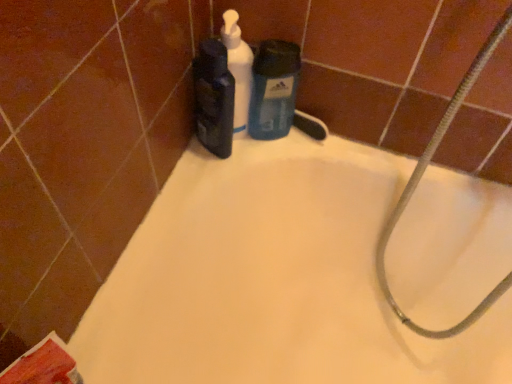
This screenshot has width=512, height=384. I want to click on white matte bathtub at upper center, so 272,279.

What is the approximate width of white matte pump bottle at upper center, acting as the 2th cleaning product starting from the right?

white matte pump bottle at upper center, acting as the 2th cleaning product starting from the right, is 1.84 inches in width.

Find the location of a particular element. The height and width of the screenshot is (384, 512). silvery metallic hose at upper right is located at coordinates (419, 181).

In order to face matte black bottle at upper center, the third cleaning product in the right-to-left sequence, should I rotate leftwards or rightwards?

Turn left by 4.477 degrees to look at matte black bottle at upper center, the third cleaning product in the right-to-left sequence.

Where is `white matte bathtub at upper center`? Image resolution: width=512 pixels, height=384 pixels. white matte bathtub at upper center is located at coordinates (272, 279).

From a real-world perspective, is white matte pump bottle at upper center, which is counted as the second cleaning product, starting from the left, located higher than matte black bottle at upper center, acting as the first cleaning product starting from the left?

Yes.

Looking at this image, considering the relative positions of white matte pump bottle at upper center, which is counted as the second cleaning product, starting from the left, and matte black bottle at upper center, the third cleaning product in the right-to-left sequence, in the image provided, is white matte pump bottle at upper center, which is counted as the second cleaning product, starting from the left, to the left of matte black bottle at upper center, the third cleaning product in the right-to-left sequence, from the viewer's perspective?

No, white matte pump bottle at upper center, which is counted as the second cleaning product, starting from the left, is not to the left of matte black bottle at upper center, the third cleaning product in the right-to-left sequence.

Between white matte pump bottle at upper center, acting as the 2th cleaning product starting from the right, and matte black bottle at upper center, acting as the first cleaning product starting from the left, which one has more height?

white matte pump bottle at upper center, acting as the 2th cleaning product starting from the right.

Is white matte pump bottle at upper center, acting as the 2th cleaning product starting from the right, facing towards matte black bottle at upper center, acting as the first cleaning product starting from the left?

Yes, white matte pump bottle at upper center, acting as the 2th cleaning product starting from the right, is facing matte black bottle at upper center, acting as the first cleaning product starting from the left.

In the image, is silvery metallic hose at upper right positioned in front of or behind white matte bathtub at upper center?

Clearly, silvery metallic hose at upper right is in front of white matte bathtub at upper center.

Measure the distance from silvery metallic hose at upper right to white matte bathtub at upper center.

silvery metallic hose at upper right is 6.88 inches away from white matte bathtub at upper center.

What are the coordinates of `bathtub below the silvery metallic hose at upper right (from the image's perspective)` in the screenshot? It's located at (272, 279).

Is matte black bottle at upper center, acting as the first cleaning product starting from the left, positioned with its back to white matte pump bottle at upper center, acting as the 2th cleaning product starting from the right?

Yes, matte black bottle at upper center, acting as the first cleaning product starting from the left,'s orientation is away from white matte pump bottle at upper center, acting as the 2th cleaning product starting from the right.

From a real-world perspective, is matte black bottle at upper center, acting as the first cleaning product starting from the left, located higher than white matte pump bottle at upper center, acting as the 2th cleaning product starting from the right?

No.

From the picture: Does matte black bottle at upper center, the third cleaning product in the right-to-left sequence, have a larger size compared to white matte pump bottle at upper center, acting as the 2th cleaning product starting from the right?

Yes.

Does matte black bottle at upper center, acting as the first cleaning product starting from the left, have a lesser width compared to white matte pump bottle at upper center, which is counted as the second cleaning product, starting from the left?

No, matte black bottle at upper center, acting as the first cleaning product starting from the left, is not thinner than white matte pump bottle at upper center, which is counted as the second cleaning product, starting from the left.

Visually, is blue matte liquid soap at center, which is the 3th cleaning product in left-to-right order, positioned to the left or to the right of matte black bottle at upper center, acting as the first cleaning product starting from the left?

From the image, it's evident that blue matte liquid soap at center, which is the 3th cleaning product in left-to-right order, is to the right of matte black bottle at upper center, acting as the first cleaning product starting from the left.

From a real-world perspective, is blue matte liquid soap at center, which is the 3th cleaning product in left-to-right order, on matte black bottle at upper center, the third cleaning product in the right-to-left sequence?

No, from a real-world perspective, blue matte liquid soap at center, which is the 3th cleaning product in left-to-right order, is not above matte black bottle at upper center, the third cleaning product in the right-to-left sequence.

Starting from the blue matte liquid soap at center, which ranks as the 1th cleaning product in right-to-left order, which cleaning product is the 2nd one in front? Please provide its 2D coordinates.

[(214, 98)]

Is silvery metallic hose at upper right in front of or behind white matte pump bottle at upper center, acting as the 2th cleaning product starting from the right, in the image?

silvery metallic hose at upper right is positioned closer to the viewer than white matte pump bottle at upper center, acting as the 2th cleaning product starting from the right.

Looking at this image, is silvery metallic hose at upper right not close to white matte pump bottle at upper center, acting as the 2th cleaning product starting from the right?

No, silvery metallic hose at upper right is in close proximity to white matte pump bottle at upper center, acting as the 2th cleaning product starting from the right.

Is silvery metallic hose at upper right inside the boundaries of white matte pump bottle at upper center, which is counted as the second cleaning product, starting from the left, or outside?

The correct answer is: outside.

From the image's perspective, is silvery metallic hose at upper right above or below white matte pump bottle at upper center, which is counted as the second cleaning product, starting from the left?

silvery metallic hose at upper right is situated lower than white matte pump bottle at upper center, which is counted as the second cleaning product, starting from the left, in the image.

Is white matte pump bottle at upper center, acting as the 2th cleaning product starting from the right, looking in the opposite direction of silvery metallic hose at upper right?

No, silvery metallic hose at upper right is not at the back of white matte pump bottle at upper center, acting as the 2th cleaning product starting from the right.

Is point (248, 106) positioned behind point (405, 195)?

That is False.

Considering the relative sizes of white matte pump bottle at upper center, acting as the 2th cleaning product starting from the right, and silvery metallic hose at upper right in the image provided, is white matte pump bottle at upper center, acting as the 2th cleaning product starting from the right, bigger than silvery metallic hose at upper right?

No.

Is white matte pump bottle at upper center, which is counted as the second cleaning product, starting from the left, positioned in front of silvery metallic hose at upper right?

No, white matte pump bottle at upper center, which is counted as the second cleaning product, starting from the left, is behind silvery metallic hose at upper right.

Consider the image. Can you tell me how much matte black bottle at upper center, acting as the first cleaning product starting from the left, and blue matte liquid soap at center, which is the 3th cleaning product in left-to-right order, differ in facing direction?

The angular difference between matte black bottle at upper center, acting as the first cleaning product starting from the left, and blue matte liquid soap at center, which is the 3th cleaning product in left-to-right order, is 34.8 degrees.

Is point (200, 43) farther from camera compared to point (295, 91)?

No, it is in front of (295, 91).

Is matte black bottle at upper center, acting as the first cleaning product starting from the left, aimed at blue matte liquid soap at center, which ranks as the 1th cleaning product in right-to-left order?

No, matte black bottle at upper center, acting as the first cleaning product starting from the left, is not oriented towards blue matte liquid soap at center, which ranks as the 1th cleaning product in right-to-left order.

How distant is matte black bottle at upper center, the third cleaning product in the right-to-left sequence, from blue matte liquid soap at center, which is the 3th cleaning product in left-to-right order?

matte black bottle at upper center, the third cleaning product in the right-to-left sequence, is 2.94 inches away from blue matte liquid soap at center, which is the 3th cleaning product in left-to-right order.

Find the location of a particular element. This screenshot has height=384, width=512. cleaning product that appears in front of the white matte pump bottle at upper center, acting as the 2th cleaning product starting from the right is located at coordinates (214, 98).

Locate an element on the screen. The height and width of the screenshot is (384, 512). garden hose above the white matte bathtub at upper center (from a real-world perspective) is located at coordinates [419, 181].

Which object lies nearer to the anchor point silvery metallic hose at upper right, white matte bathtub at upper center or matte black bottle at upper center, acting as the first cleaning product starting from the left?

white matte bathtub at upper center is positioned closer to the anchor silvery metallic hose at upper right.

When comparing their distances from silvery metallic hose at upper right, does blue matte liquid soap at center, which is the 3th cleaning product in left-to-right order, or white matte bathtub at upper center seem closer?

white matte bathtub at upper center.

From the image, which object appears to be nearer to matte black bottle at upper center, acting as the first cleaning product starting from the left, white matte bathtub at upper center or blue matte liquid soap at center, which is the 3th cleaning product in left-to-right order?

blue matte liquid soap at center, which is the 3th cleaning product in left-to-right order, is closer to matte black bottle at upper center, acting as the first cleaning product starting from the left.

In the scene shown: Estimate the real-world distances between objects in this image. Which object is closer to silvery metallic hose at upper right, white matte pump bottle at upper center, acting as the 2th cleaning product starting from the right, or matte black bottle at upper center, acting as the first cleaning product starting from the left?

white matte pump bottle at upper center, acting as the 2th cleaning product starting from the right, is closer to silvery metallic hose at upper right.

Looking at the image, which one is located closer to silvery metallic hose at upper right, white matte bathtub at upper center or blue matte liquid soap at center, which ranks as the 1th cleaning product in right-to-left order?

Based on the image, white matte bathtub at upper center appears to be nearer to silvery metallic hose at upper right.

When comparing their distances from blue matte liquid soap at center, which is the 3th cleaning product in left-to-right order, does matte black bottle at upper center, the third cleaning product in the right-to-left sequence, or white matte bathtub at upper center seem further?

white matte bathtub at upper center is positioned further to the anchor blue matte liquid soap at center, which is the 3th cleaning product in left-to-right order.

From the image, which object appears to be nearer to white matte bathtub at upper center, silvery metallic hose at upper right or white matte pump bottle at upper center, which is counted as the second cleaning product, starting from the left?

silvery metallic hose at upper right lies closer to white matte bathtub at upper center than the other object.

When comparing their distances from silvery metallic hose at upper right, does white matte bathtub at upper center or white matte pump bottle at upper center, acting as the 2th cleaning product starting from the right, seem closer?

Among the two, white matte bathtub at upper center is located nearer to silvery metallic hose at upper right.

The image size is (512, 384). In order to click on garden hose between blue matte liquid soap at center, which ranks as the 1th cleaning product in right-to-left order, and white matte bathtub at upper center vertically in this screenshot , I will do `click(419, 181)`.

Locate an element on the screen. cleaning product situated between matte black bottle at upper center, the third cleaning product in the right-to-left sequence, and blue matte liquid soap at center, which ranks as the 1th cleaning product in right-to-left order, from left to right is located at coordinates (238, 70).

Identify the location of cleaning product that lies between blue matte liquid soap at center, which is the 3th cleaning product in left-to-right order, and white matte bathtub at upper center from top to bottom. The height and width of the screenshot is (384, 512). (214, 98).

Image resolution: width=512 pixels, height=384 pixels. Identify the location of garden hose between matte black bottle at upper center, acting as the first cleaning product starting from the left, and white matte bathtub at upper center in the up-down direction. (419, 181).